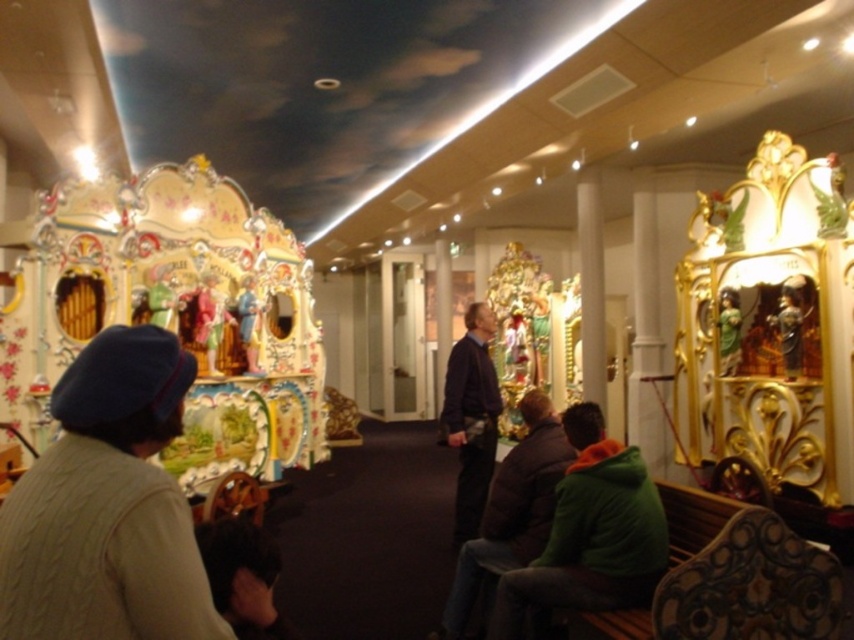
Does green fleece jacket at lower center have a lesser width compared to dark blue sweater at center?

No, green fleece jacket at lower center is not thinner than dark blue sweater at center.

Is point (629, 563) farther from viewer compared to point (484, 355)?

That is False.

Find the location of `green fleece jacket at lower center`. green fleece jacket at lower center is located at coordinates (589, 534).

Is cable-knit sweater at lower left above dark brown leather jacket at center?

Yes.

Does cable-knit sweater at lower left come in front of dark brown leather jacket at center?

That is True.

Is point (72, 540) closer to viewer compared to point (443, 627)?

Yes, point (72, 540) is in front of point (443, 627).

At what (x,y) coordinates should I click in order to perform the action: click on cable-knit sweater at lower left. Please return your answer as a coordinate pair (x, y). Looking at the image, I should click on (107, 506).

Is green fleece jacket at lower center below dark brown leather jacket at center?

Actually, green fleece jacket at lower center is above dark brown leather jacket at center.

Who is more forward, (598, 595) or (461, 627)?

Point (598, 595) is more forward.

Locate an element on the screen. green fleece jacket at lower center is located at coordinates (589, 534).